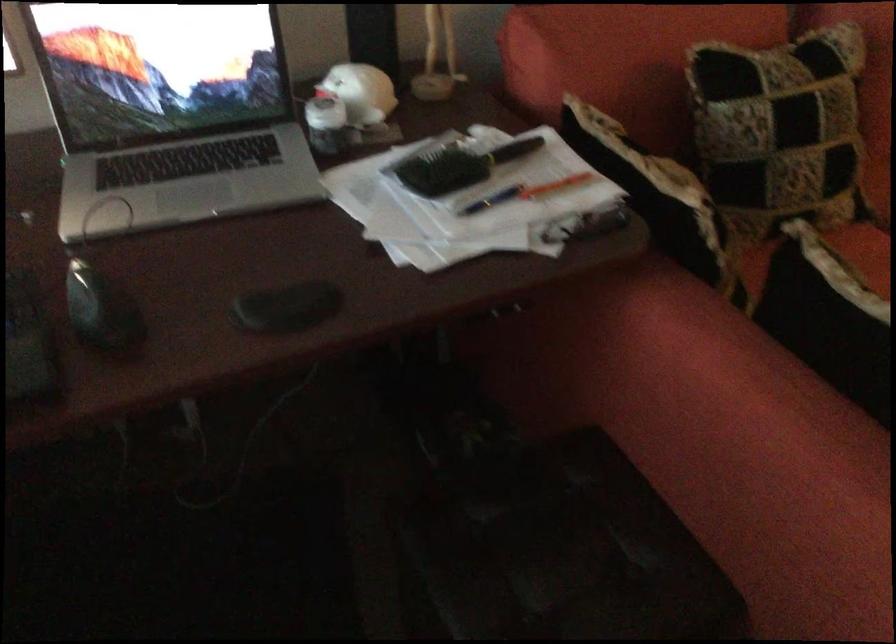
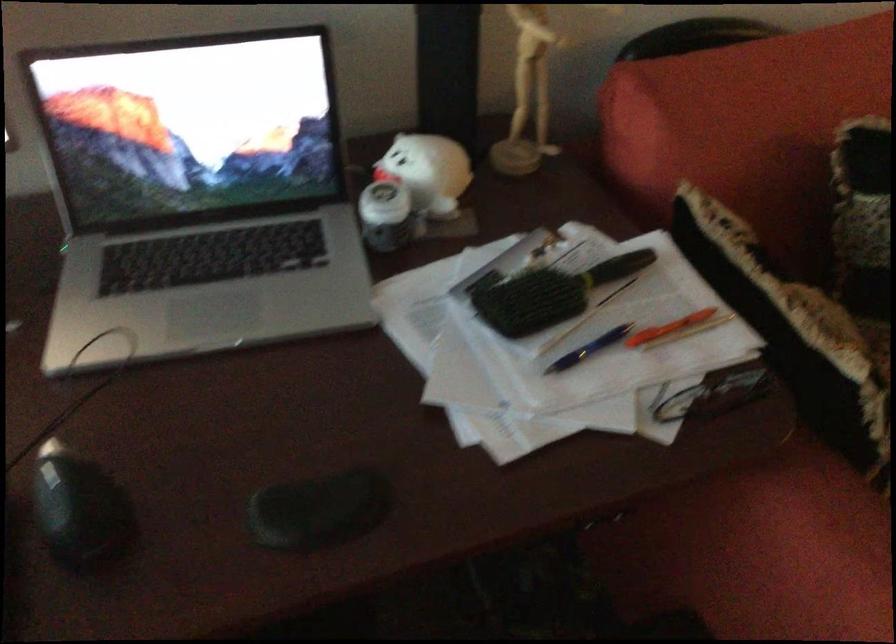
The point at (325, 120) is marked in the first image. Where is the corresponding point in the second image?

(383, 216)